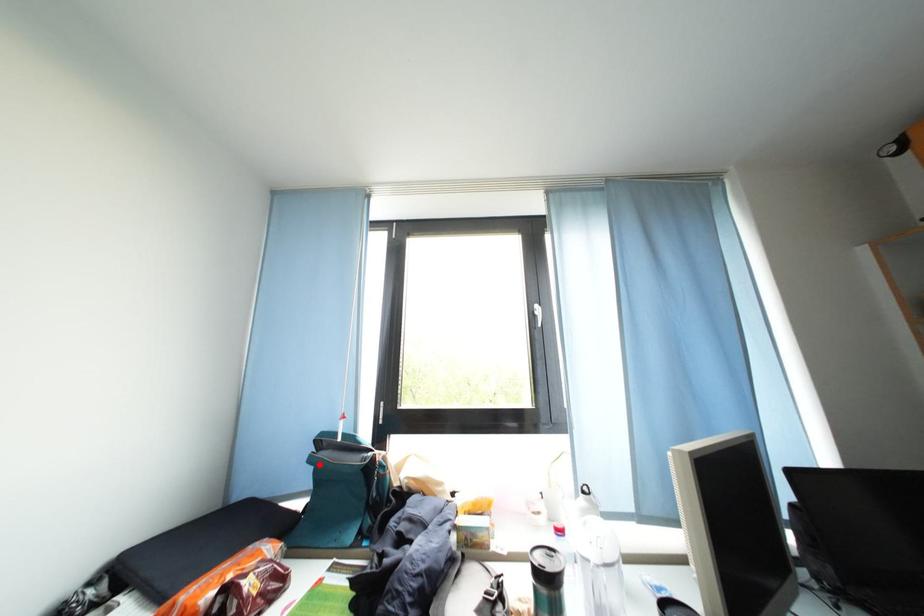
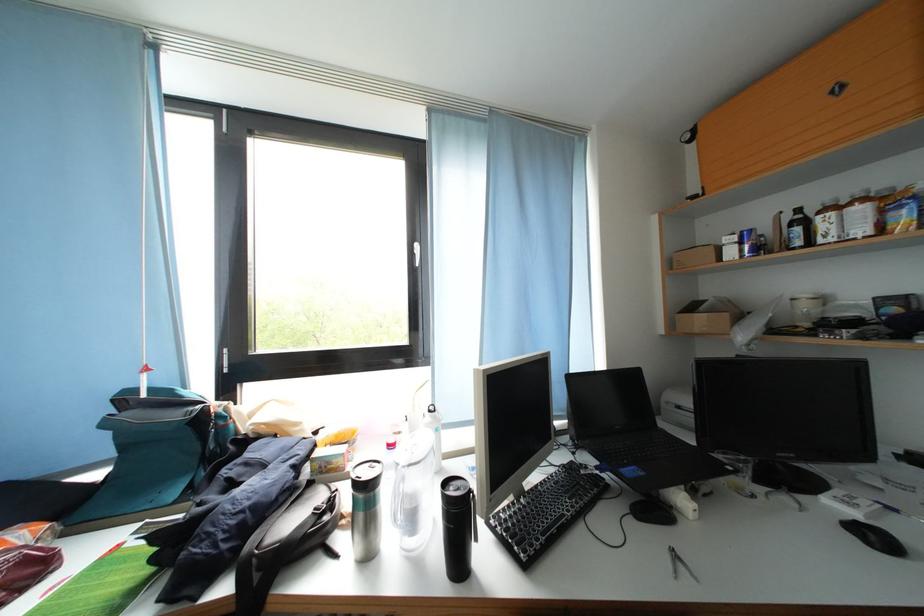
Find the pixel in the second image that matches the highlighted location in the first image.

(114, 429)